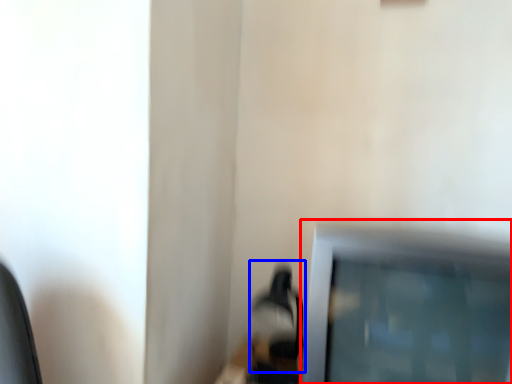
Question: Which object appears farthest to the camera in this image, television (highlighted by a red box) or table lamp (highlighted by a blue box)?

Choices:
 (A) television
 (B) table lamp

Answer: (B)